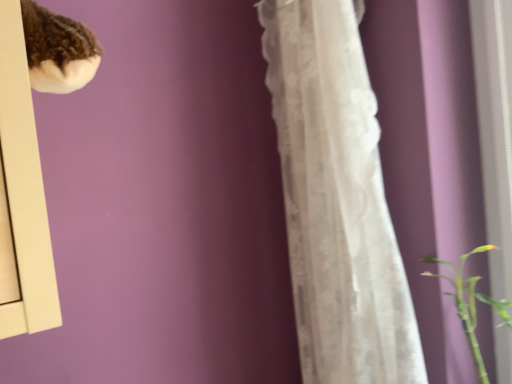
Question: Considering the positions of white lace curtain at center and green smooth stem at lower right in the image, is white lace curtain at center bigger or smaller than green smooth stem at lower right?

Choices:
 (A) small
 (B) big

Answer: (B)

Question: From the image's perspective, is white lace curtain at center located above or below green smooth stem at lower right?

Choices:
 (A) below
 (B) above

Answer: (B)

Question: From a real-world perspective, is white lace curtain at center above or below green smooth stem at lower right?

Choices:
 (A) above
 (B) below

Answer: (A)

Question: From a real-world perspective, relative to white lace curtain at center, is green smooth stem at lower right vertically above or below?

Choices:
 (A) above
 (B) below

Answer: (B)

Question: Is green smooth stem at lower right spatially inside white lace curtain at center, or outside of it?

Choices:
 (A) outside
 (B) inside

Answer: (A)

Question: Is green smooth stem at lower right in front of or behind white lace curtain at center in the image?

Choices:
 (A) front
 (B) behind

Answer: (B)

Question: Considering the positions of green smooth stem at lower right and white lace curtain at center in the image, is green smooth stem at lower right taller or shorter than white lace curtain at center?

Choices:
 (A) tall
 (B) short

Answer: (B)